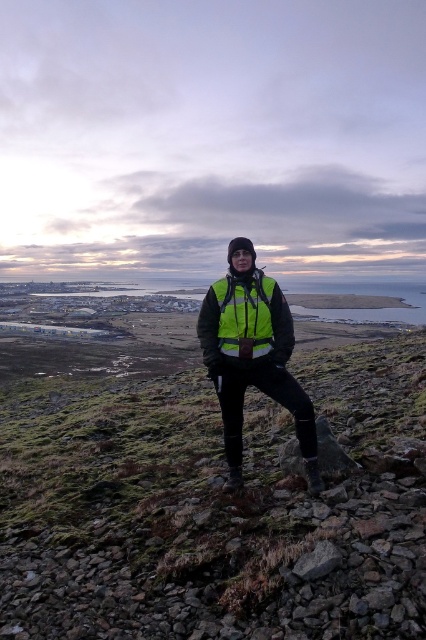
You are a hiker trying to locate two safety vests in the scene. The neon yellow reflective vest at center and the high visibility fabric safety vest at center are both visible. Which one is closer to you?

The neon yellow reflective vest at center is closer to you because it is in front of the high visibility fabric safety vest at center.

You are a hiker who needs to ensure your safety vest is visible to others. You have both the neon yellow reflective vest at center and the high visibility fabric safety vest at center. According to the image, which one is more visible from above? Please explain based on their positions.

The high visibility fabric safety vest at center is more visible from above because it is positioned over the neon yellow reflective vest at center, making it closer to the observer above.

You are a hiker who needs to choose between two safety vests to ensure visibility. The reflective green vest at center and the high visibility fabric safety vest at center are available. Which one is taller?

The reflective green vest at center is taller than the high visibility fabric safety vest at center.